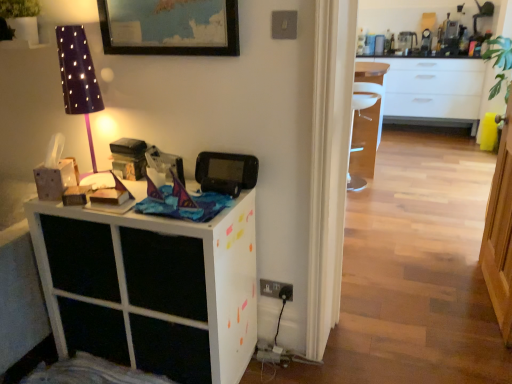
The image size is (512, 384). In order to click on free space above white matte cabinet at left (from a real-world perspective) in this screenshot , I will do `click(135, 199)`.